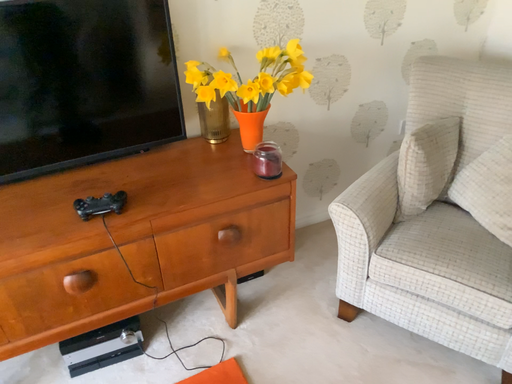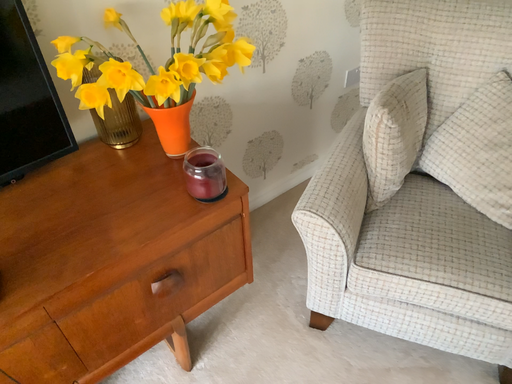
Question: Which way did the camera rotate in the video?

Choices:
 (A) rotated right
 (B) rotated left

Answer: (A)